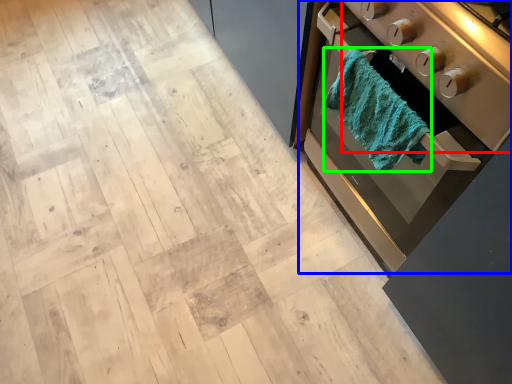
Question: Considering the real-world distances, which object is farthest from appliance (highlighted by a red box)? home appliance (highlighted by a blue box) or bath towel (highlighted by a green box)?

Choices:
 (A) home appliance
 (B) bath towel

Answer: (A)